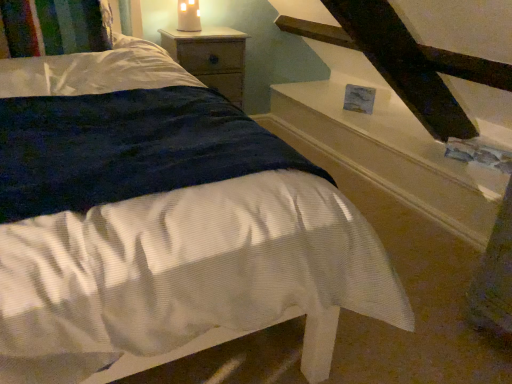
The height and width of the screenshot is (384, 512). Describe the element at coordinates (388, 145) in the screenshot. I see `white glossy stairwell at upper right` at that location.

The width and height of the screenshot is (512, 384). In order to click on wooden nightstand at upper center in this screenshot , I will do `click(211, 57)`.

The width and height of the screenshot is (512, 384). What do you see at coordinates (54, 27) in the screenshot?
I see `multicolored knitted pillow at upper left` at bounding box center [54, 27].

Where is `white glossy stairwell at upper right`? This screenshot has height=384, width=512. white glossy stairwell at upper right is located at coordinates (388, 145).

Is multicolored knitted pillow at upper left smaller than wooden nightstand at upper center?

Yes, multicolored knitted pillow at upper left is smaller than wooden nightstand at upper center.

Is point (7, 16) positioned after point (222, 66)?

No, (7, 16) is closer to viewer.

Is multicolored knitted pillow at upper left surrounding wooden nightstand at upper center?

No, wooden nightstand at upper center is located outside of multicolored knitted pillow at upper left.

Can you confirm if multicolored knitted pillow at upper left is positioned to the right of wooden nightstand at upper center?

No, multicolored knitted pillow at upper left is not to the right of wooden nightstand at upper center.

From the image's perspective, which one is positioned lower, matte white candle at upper center or white glossy stairwell at upper right?

From the image's view, white glossy stairwell at upper right is below.

Is matte white candle at upper center oriented towards white glossy stairwell at upper right?

No, matte white candle at upper center is not facing towards white glossy stairwell at upper right.

Which is more to the right, matte white candle at upper center or white glossy stairwell at upper right?

From the viewer's perspective, white glossy stairwell at upper right appears more on the right side.

Where is `stairwell below the matte white candle at upper center (from the image's perspective)`? stairwell below the matte white candle at upper center (from the image's perspective) is located at coordinates (388, 145).

What's the angular difference between white glossy stairwell at upper right and multicolored knitted pillow at upper left's facing directions?

The angle between the facing direction of white glossy stairwell at upper right and the facing direction of multicolored knitted pillow at upper left is 2 degrees.

Is white glossy stairwell at upper right smaller than multicolored knitted pillow at upper left?

Actually, white glossy stairwell at upper right might be larger than multicolored knitted pillow at upper left.

From the image's perspective, is white glossy stairwell at upper right located beneath multicolored knitted pillow at upper left?

Yes, from the image's perspective, white glossy stairwell at upper right is beneath multicolored knitted pillow at upper left.

Is matte white candle at upper center situated inside multicolored knitted pillow at upper left or outside?

matte white candle at upper center is spatially situated outside multicolored knitted pillow at upper left.

Who is taller, matte white candle at upper center or multicolored knitted pillow at upper left?

With more height is matte white candle at upper center.

From a real-world perspective, is matte white candle at upper center physically below multicolored knitted pillow at upper left?

No, from a real-world perspective, matte white candle at upper center is not below multicolored knitted pillow at upper left.

Is white glossy stairwell at upper right wider or thinner than wooden nightstand at upper center?

Considering their sizes, white glossy stairwell at upper right looks broader than wooden nightstand at upper center.

Which object is closer to the camera, white glossy stairwell at upper right or wooden nightstand at upper center?

white glossy stairwell at upper right is closer to the camera.

Is white glossy stairwell at upper right positioned with its back to wooden nightstand at upper center?

That's not correct — white glossy stairwell at upper right is not looking away from wooden nightstand at upper center.

Based on the photo, measure the distance between white glossy stairwell at upper right and wooden nightstand at upper center.

The distance of white glossy stairwell at upper right from wooden nightstand at upper center is 29.68 inches.

Is matte white candle at upper center not within wooden nightstand at upper center?

matte white candle at upper center is positioned outside wooden nightstand at upper center.

Considering the positions of objects matte white candle at upper center and wooden nightstand at upper center in the image provided, who is behind, matte white candle at upper center or wooden nightstand at upper center?

matte white candle at upper center.

How distant is matte white candle at upper center from wooden nightstand at upper center?

A distance of 11.94 inches exists between matte white candle at upper center and wooden nightstand at upper center.

Which object is positioned more to the right, wooden nightstand at upper center or matte white candle at upper center?

From the viewer's perspective, wooden nightstand at upper center appears more on the right side.

Could you tell me if wooden nightstand at upper center is turned towards matte white candle at upper center?

No.

Does wooden nightstand at upper center come behind matte white candle at upper center?

That is False.

How many degrees apart are the facing directions of wooden nightstand at upper center and matte white candle at upper center?

The angle between the facing direction of wooden nightstand at upper center and the facing direction of matte white candle at upper center is 3.81 degrees.

The width and height of the screenshot is (512, 384). What are the coordinates of `nightstand behind the multicolored knitted pillow at upper left` in the screenshot? It's located at (211, 57).

At what (x,y) coordinates should I click in order to perform the action: click on candle holder on the left side of white glossy stairwell at upper right. Please return your answer as a coordinate pair (x, y). The height and width of the screenshot is (384, 512). Looking at the image, I should click on (189, 16).

When comparing their distances from white glossy stairwell at upper right, does wooden nightstand at upper center or matte white candle at upper center seem closer?

wooden nightstand at upper center.

Considering their positions, is white glossy stairwell at upper right positioned further to multicolored knitted pillow at upper left than matte white candle at upper center?

white glossy stairwell at upper right.

When comparing their distances from multicolored knitted pillow at upper left, does wooden nightstand at upper center or white glossy stairwell at upper right seem further?

Based on the image, white glossy stairwell at upper right appears to be further to multicolored knitted pillow at upper left.

Considering their positions, is wooden nightstand at upper center positioned further to matte white candle at upper center than white glossy stairwell at upper right?

white glossy stairwell at upper right.

Which object lies further to the anchor point wooden nightstand at upper center, white glossy stairwell at upper right or matte white candle at upper center?

The object further to wooden nightstand at upper center is white glossy stairwell at upper right.

Estimate the real-world distances between objects in this image. Which object is further from matte white candle at upper center, multicolored knitted pillow at upper left or wooden nightstand at upper center?

multicolored knitted pillow at upper left.

Estimate the real-world distances between objects in this image. Which object is closer to matte white candle at upper center, wooden nightstand at upper center or multicolored knitted pillow at upper left?

wooden nightstand at upper center lies closer to matte white candle at upper center than the other object.

In the scene shown: Estimate the real-world distances between objects in this image. Which object is further from white glossy stairwell at upper right, matte white candle at upper center or multicolored knitted pillow at upper left?

multicolored knitted pillow at upper left is positioned further to the anchor white glossy stairwell at upper right.

Locate an element on the screen. nightstand between multicolored knitted pillow at upper left and white glossy stairwell at upper right from left to right is located at coordinates (211, 57).

The width and height of the screenshot is (512, 384). Find the location of `candle holder between multicolored knitted pillow at upper left and white glossy stairwell at upper right`. candle holder between multicolored knitted pillow at upper left and white glossy stairwell at upper right is located at coordinates (189, 16).

Where is `nightstand between multicolored knitted pillow at upper left and matte white candle at upper center in the front-back direction`? The image size is (512, 384). nightstand between multicolored knitted pillow at upper left and matte white candle at upper center in the front-back direction is located at coordinates (211, 57).

Identify the location of nightstand situated between matte white candle at upper center and white glossy stairwell at upper right from left to right. Image resolution: width=512 pixels, height=384 pixels. (211, 57).